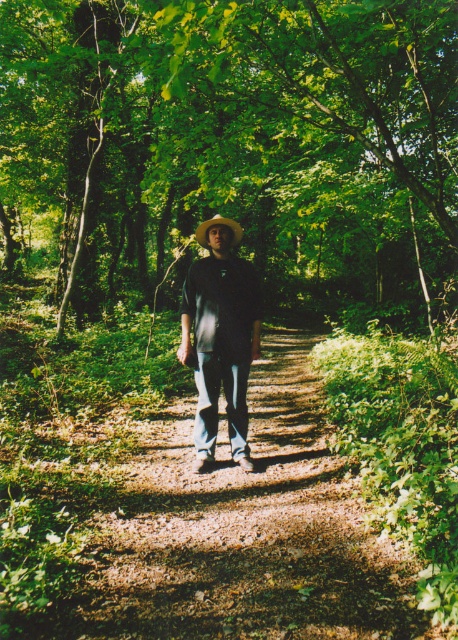
In the scene shown: You are a hiker who wants to take a photo of the brown straw cowboy hat at center without any obstruction. Is there a way to position yourself so that the green leafy tree at center isn not blocking the view of the hat?

The green leafy tree at center is above the brown straw cowboy hat at center, so if you position yourself below the hat, the tree won

You are a hiker on a narrow dirt path in a forest. You notice a green leafy tree at center and a matte black shirt at center. Which object is positioned higher relative to the other?

The green leafy tree at center is located above the matte black shirt at center, so it is positioned higher.